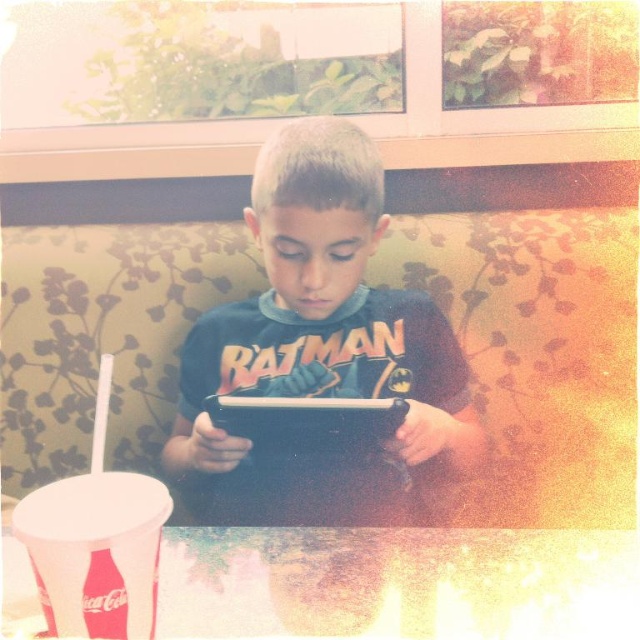
Question: Observing the image, what is the correct spatial positioning of matte black shirt at center in reference to black matte tablet at center?

Choices:
 (A) above
 (B) below

Answer: (A)

Question: Does matte black shirt at center come in front of black matte tablet at center?

Choices:
 (A) yes
 (B) no

Answer: (B)

Question: Can you confirm if matte black shirt at center is positioned to the right of black matte tablet at center?

Choices:
 (A) no
 (B) yes

Answer: (A)